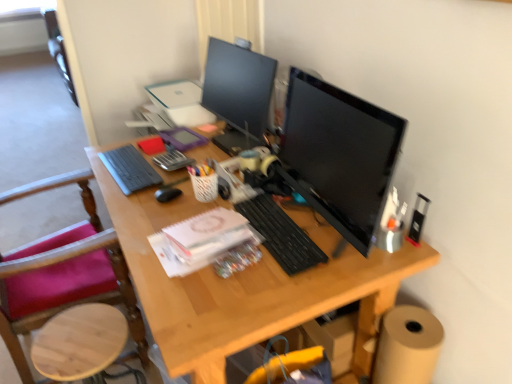
Question: Does matte black computer tower at center appear on the right side of gray matte keyboard at left, the second computer keyboard positioned from the front?

Choices:
 (A) yes
 (B) no

Answer: (A)

Question: Is matte black computer tower at center to the left of gray matte keyboard at left, which is the first computer keyboard in back-to-front order, from the viewer's perspective?

Choices:
 (A) no
 (B) yes

Answer: (A)

Question: Is matte black computer tower at center closer to the viewer compared to gray matte keyboard at left, which is the first computer keyboard in back-to-front order?

Choices:
 (A) yes
 (B) no

Answer: (A)

Question: Would you say matte black computer tower at center is a long distance from gray matte keyboard at left, which is the first computer keyboard in back-to-front order?

Choices:
 (A) yes
 (B) no

Answer: (A)

Question: Is matte black computer tower at center facing towards gray matte keyboard at left, marked as the first computer keyboard in a left-to-right arrangement?

Choices:
 (A) no
 (B) yes

Answer: (A)

Question: Considering the relative sizes of matte black computer tower at center and gray matte keyboard at left, arranged as the second computer keyboard when ordered from the bottom, in the image provided, is matte black computer tower at center shorter than gray matte keyboard at left, arranged as the second computer keyboard when ordered from the bottom,?

Choices:
 (A) no
 (B) yes

Answer: (A)

Question: Is matte black computer tower at center oriented away from black matte mouse at center?

Choices:
 (A) yes
 (B) no

Answer: (B)

Question: Would you say matte black computer tower at center contains black matte mouse at center?

Choices:
 (A) no
 (B) yes

Answer: (A)

Question: Is matte black computer tower at center taller than black matte mouse at center?

Choices:
 (A) yes
 (B) no

Answer: (A)

Question: Is matte black computer tower at center positioned beyond the bounds of black matte mouse at center?

Choices:
 (A) yes
 (B) no

Answer: (A)

Question: Is matte black computer tower at center bigger than black matte mouse at center?

Choices:
 (A) no
 (B) yes

Answer: (B)

Question: Is matte black computer tower at center behind black matte mouse at center?

Choices:
 (A) yes
 (B) no

Answer: (B)

Question: Is metallic black stapler at right, which appears as the second stationery when viewed from the top, next to matte black computer tower at center and touching it?

Choices:
 (A) yes
 (B) no

Answer: (A)